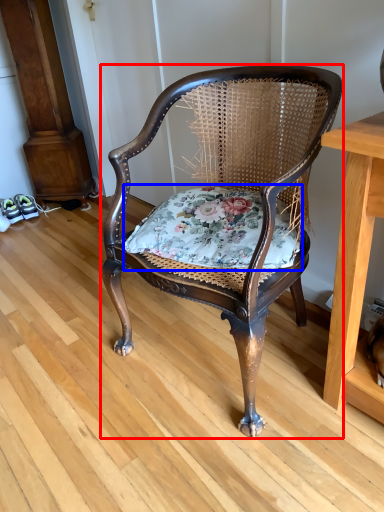
Question: Which object appears closest to the camera in this image, chair (highlighted by a red box) or blanket (highlighted by a blue box)?

Choices:
 (A) chair
 (B) blanket

Answer: (A)